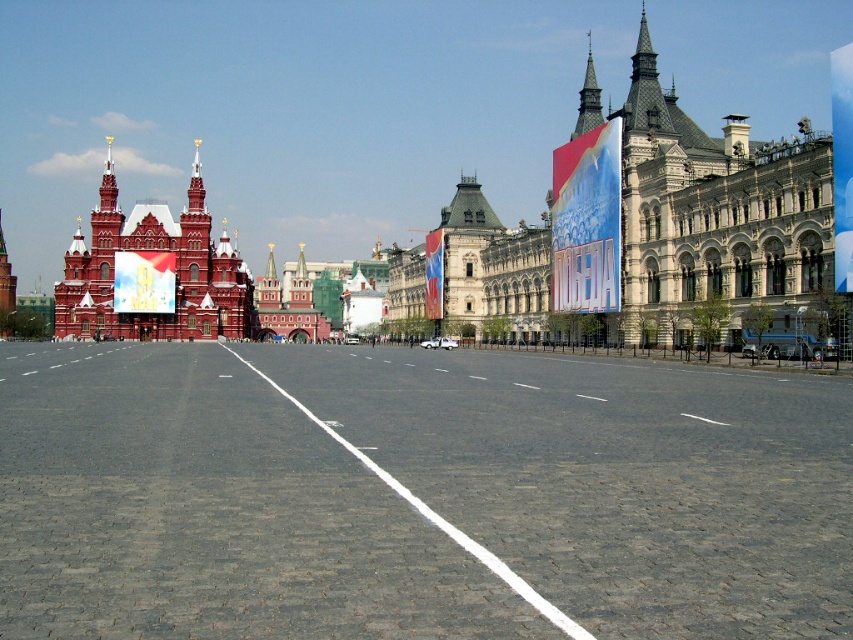
You are standing at the entrance of the plaza and want to reach the gray cobblestone plaza at center. According to the map coordinates, where exactly should you head?

The gray cobblestone plaza at center is located at point [416,493], so you should head towards that coordinate to reach it.

You are standing at the point closest to you in the image. Which point are you at, point (183,273) or point (596,83)?

You are at point (596,83) because point (183,273) is behind it, meaning point (596,83) is closer to you.